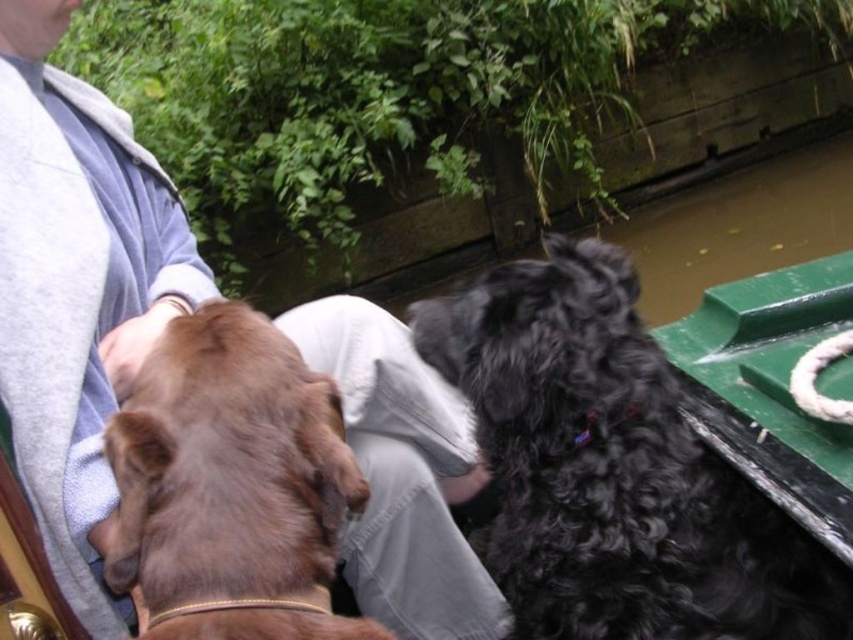
Question: Can you confirm if gray fleece jacket at upper left is positioned above black curly fur dog at right?

Choices:
 (A) yes
 (B) no

Answer: (A)

Question: Which is farther from the gray fleece jacket at upper left?

Choices:
 (A) black curly fur dog at right
 (B) brown furry dog at left

Answer: (A)

Question: Which object is closer to the camera taking this photo?

Choices:
 (A) brown furry dog at left
 (B) black curly fur dog at right

Answer: (A)

Question: Does gray fleece jacket at upper left appear on the right side of brown furry dog at left?

Choices:
 (A) yes
 (B) no

Answer: (B)

Question: Which object is positioned farthest from the black curly fur dog at right?

Choices:
 (A) brown furry dog at left
 (B) gray fleece jacket at upper left

Answer: (B)

Question: Is gray fleece jacket at upper left further to camera compared to brown furry dog at left?

Choices:
 (A) no
 (B) yes

Answer: (B)